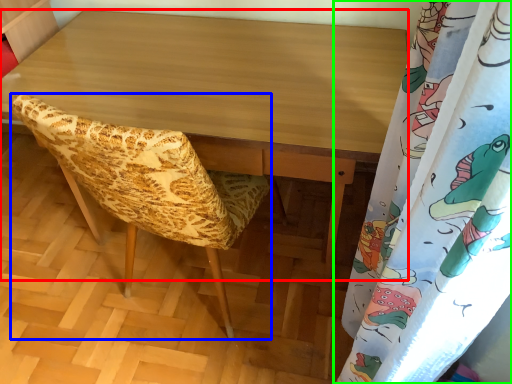
Question: Based on their relative distances, which object is nearer to desk (highlighted by a red box)? Choose from furniture (highlighted by a blue box) and curtain (highlighted by a green box).

Choices:
 (A) furniture
 (B) curtain

Answer: (A)